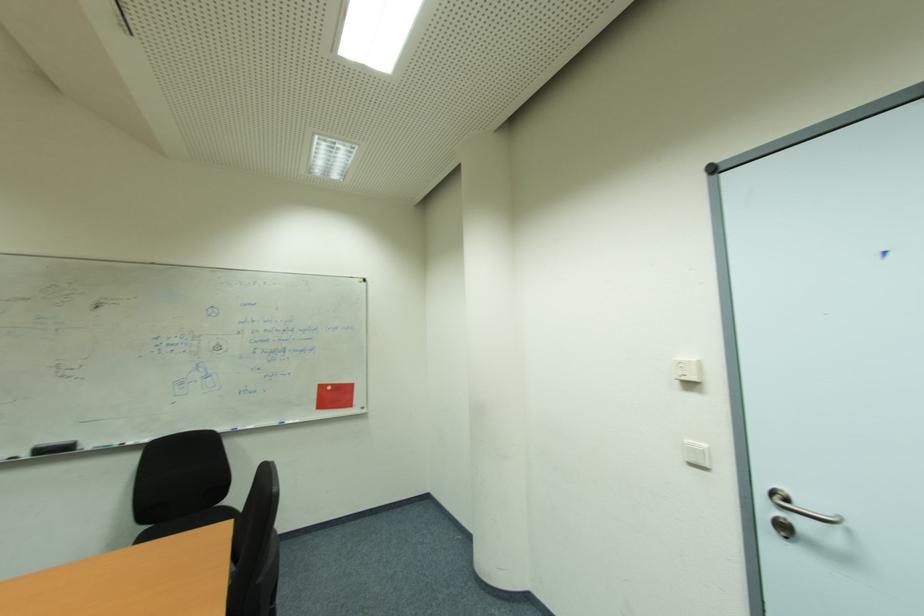
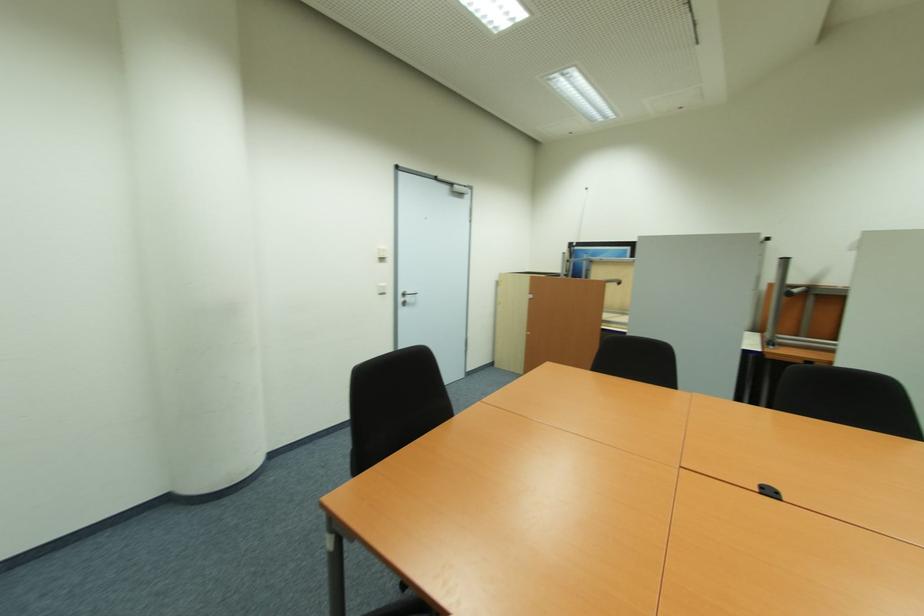
In the second image, find the point that corresponds to (x=694, y=386) in the first image.

(385, 260)